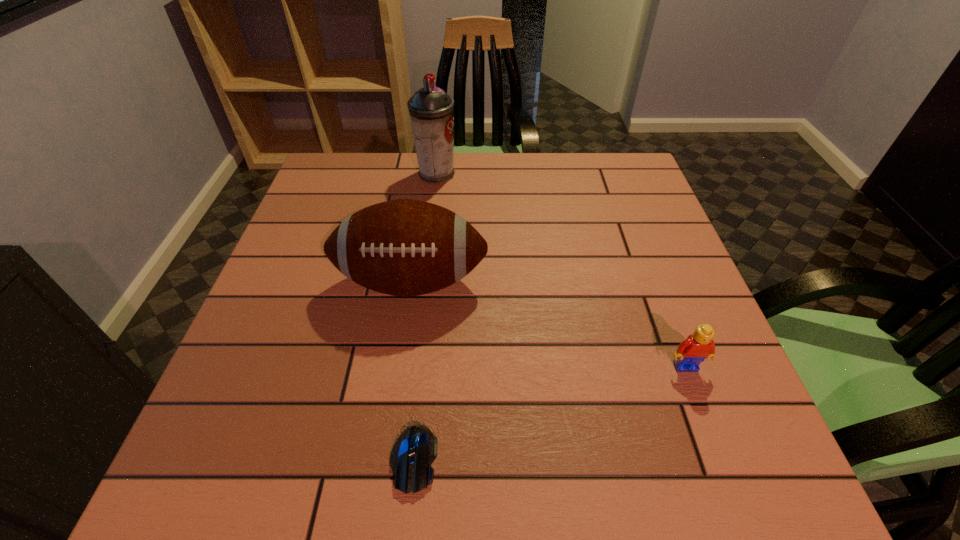
Point out which object is positioned as the second nearest to the football. Please provide its 2D coordinates. Your answer should be formatted as a tuple, i.e. [(x, y)], where the tuple contains the x and y coordinates of a point satisfying the conditions above.

[(431, 110)]

Identify the location of object that is the third nearest to the second nearest object. This screenshot has width=960, height=540. (431, 110).